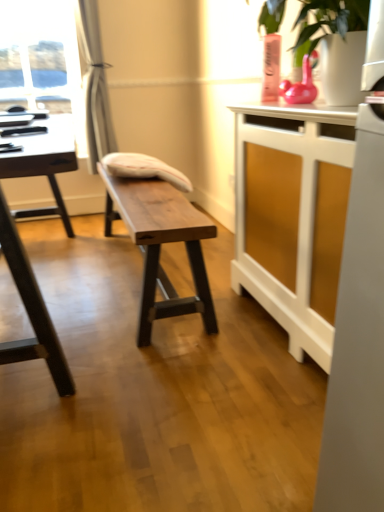
The image size is (384, 512). I want to click on vacant space situated above natural wood bench at center, which is the 2th table in left-to-right order (from a real-world perspective), so click(x=149, y=194).